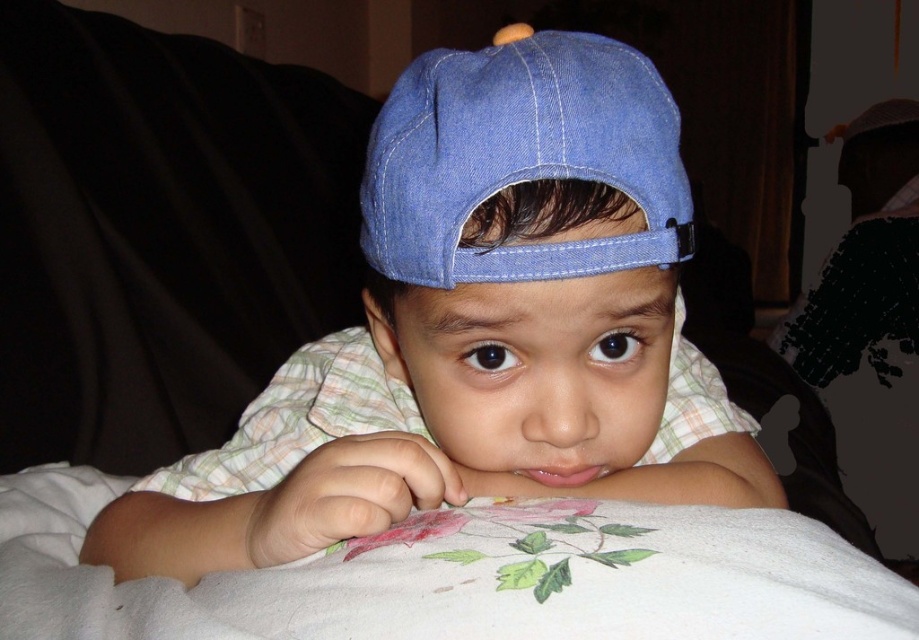
Wait, the user provided two object labels that seem to be duplicates. Let me check the rules again. The Objects are listed as denim cap at center and denim baseball cap at center. They are slightly different, so I need to include both exactly as given. The question must mention both. The Objects Description says the first is on the left of the second. The Scene mentions a light blue denim baseball cap tilted forward. Hmm, maybe the user made a typo, but I have to follow the inputs strictly. The question has

The denim cap at center is positioned on the left side of the denim baseball cap at center, so the denim cap at center is to the left of the denim baseball cap at center.

You are a photographer setting up for a portrait session. You notice two caps in the scene, a denim cap at center and a denim baseball cap at center. Which one would you choose to adjust if you want to focus on the larger object in the frame?

The denim cap at center is bigger than the denim baseball cap at center, so you should adjust the denim cap at center to focus on the larger object.